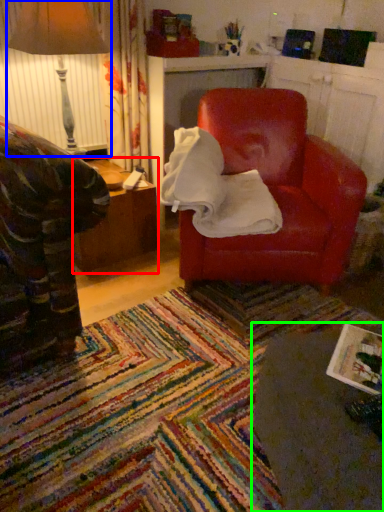
Question: Which object is positioned farthest from table (highlighted by a red box)? Select from table lamp (highlighted by a blue box) and table (highlighted by a green box).

Choices:
 (A) table lamp
 (B) table

Answer: (B)